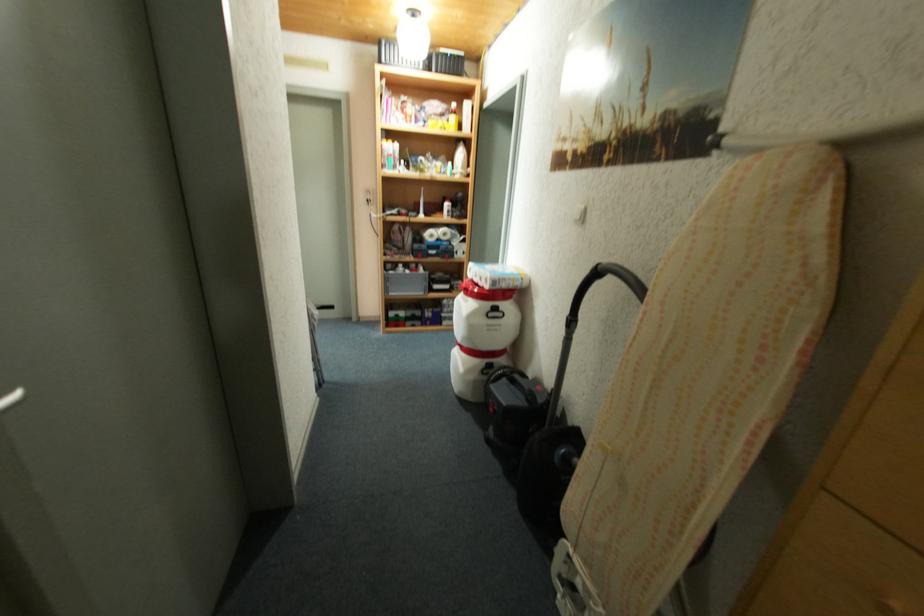
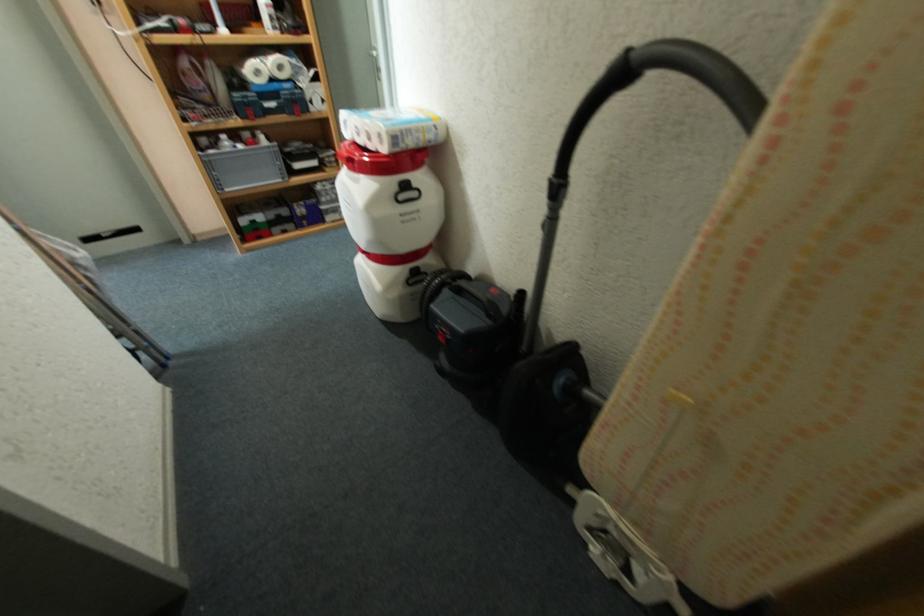
First-person continuous shooting, in which direction is the camera rotating?

The rotation direction of the camera is right-down.